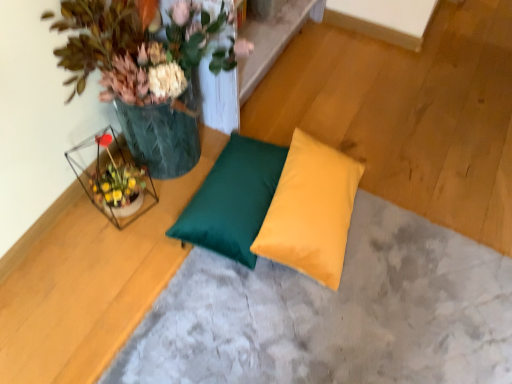
Locate an element on the screen. The width and height of the screenshot is (512, 384). free spot below matte green pillow at center (from a real-world perspective) is located at coordinates pos(339,329).